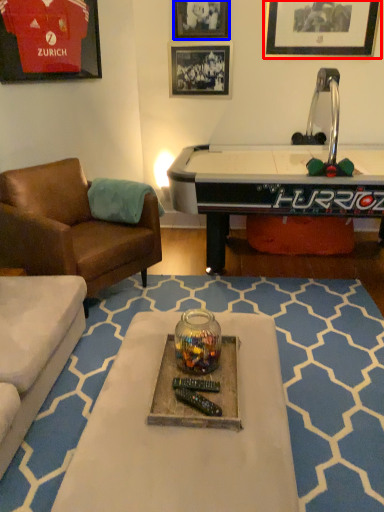
Question: Which point is further to the camera, picture frame (highlighted by a red box) or picture frame (highlighted by a blue box)?

Choices:
 (A) picture frame
 (B) picture frame

Answer: (B)